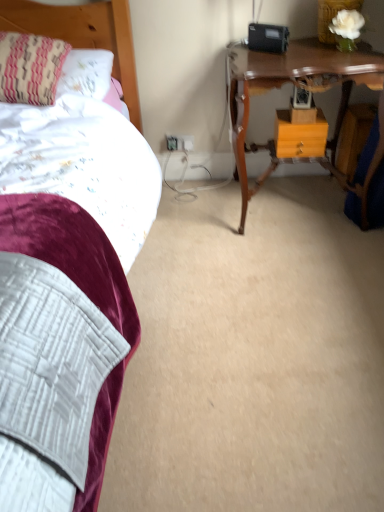
Question: Does wooden table at upper right appear on the left side of striped fabric pillow at upper left?

Choices:
 (A) yes
 (B) no

Answer: (B)

Question: From the image's perspective, is wooden table at upper right on top of striped fabric pillow at upper left?

Choices:
 (A) yes
 (B) no

Answer: (B)

Question: Is wooden table at upper right thinner than striped fabric pillow at upper left?

Choices:
 (A) no
 (B) yes

Answer: (A)

Question: Can you confirm if wooden table at upper right is taller than striped fabric pillow at upper left?

Choices:
 (A) no
 (B) yes

Answer: (B)

Question: Is striped fabric pillow at upper left at the back of wooden table at upper right?

Choices:
 (A) yes
 (B) no

Answer: (B)

Question: Considering the relative positions of wooden headboard at upper left and wooden table at upper right in the image provided, is wooden headboard at upper left to the left or to the right of wooden table at upper right?

Choices:
 (A) left
 (B) right

Answer: (A)

Question: Relative to wooden table at upper right, is wooden headboard at upper left in front or behind?

Choices:
 (A) front
 (B) behind

Answer: (B)

Question: Looking at the image, does wooden headboard at upper left seem bigger or smaller compared to wooden table at upper right?

Choices:
 (A) big
 (B) small

Answer: (B)

Question: Is wooden headboard at upper left taller or shorter than wooden table at upper right?

Choices:
 (A) short
 (B) tall

Answer: (A)

Question: Relative to wooden headboard at upper left, is orange matte drawer at center in front or behind?

Choices:
 (A) behind
 (B) front

Answer: (A)

Question: From a real-world perspective, is orange matte drawer at center physically located above or below wooden headboard at upper left?

Choices:
 (A) below
 (B) above

Answer: (A)

Question: Would you say orange matte drawer at center is to the left or to the right of wooden headboard at upper left in the picture?

Choices:
 (A) right
 (B) left

Answer: (A)

Question: Is point (297, 139) positioned closer to the camera than point (71, 26)?

Choices:
 (A) closer
 (B) farther

Answer: (A)

Question: Considering the positions of orange matte drawer at center and wooden table at upper right in the image, is orange matte drawer at center taller or shorter than wooden table at upper right?

Choices:
 (A) tall
 (B) short

Answer: (B)

Question: From the image's perspective, is orange matte drawer at center above or below wooden table at upper right?

Choices:
 (A) above
 (B) below

Answer: (A)